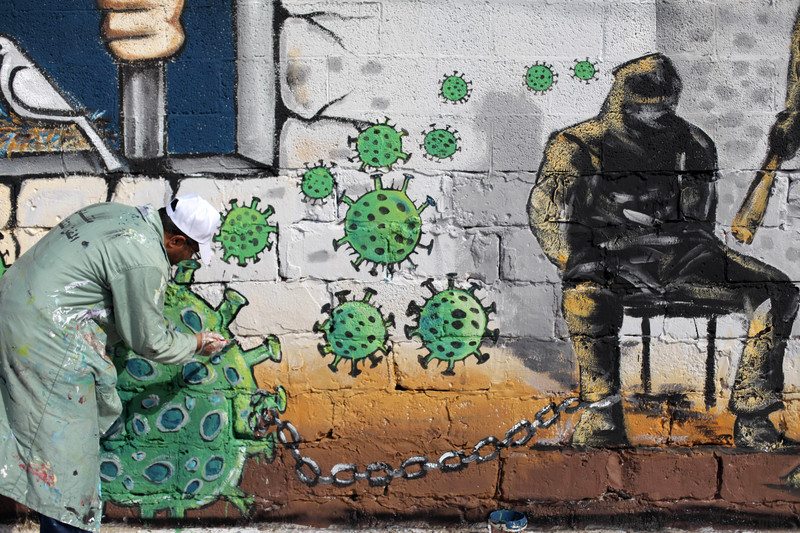
Find the location of a particular element. The width and height of the screenshot is (800, 533). chair is located at coordinates (672, 314).